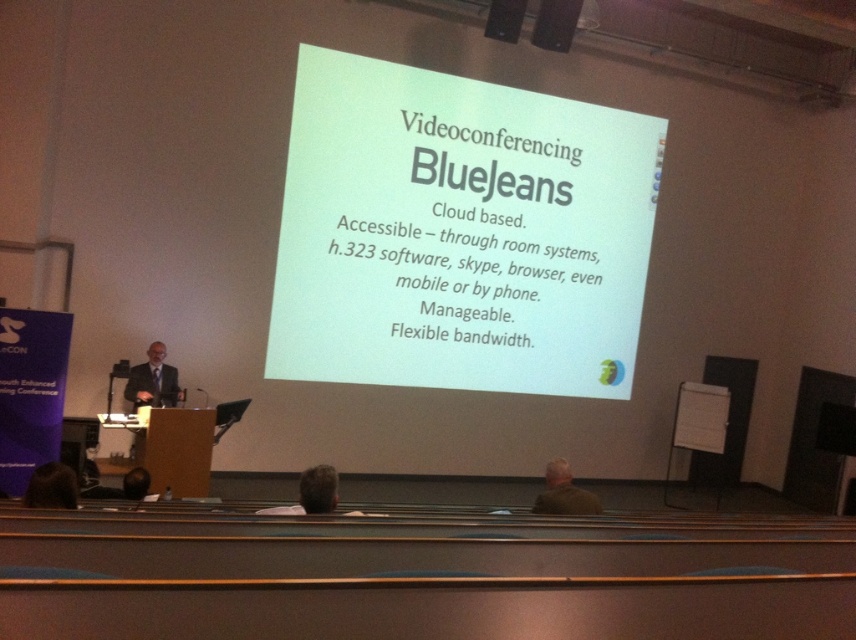
You are an event coordinator planning to place a decorative plant between the dark gray suit at left and the dark brown hair at lower left. Which object should the plant be closer to to ensure it doesn

The dark gray suit at left is larger in size than dark brown hair at lower left, so the plant should be placed closer to the dark brown hair at lower left to balance the visual weight.

You are standing in the conference room and want to place a small object on the white paper at center. What are the coordinates where you should place it?

The coordinates for placing the small object on the white paper at center are at point [459,234].